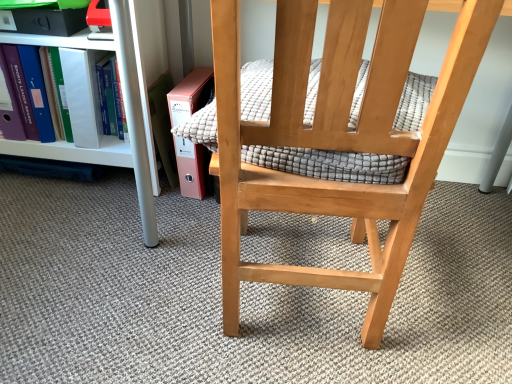
Question: Is natural wood chair at center in front of or behind white plastic shelf at left in the image?

Choices:
 (A) behind
 (B) front

Answer: (B)

Question: From the image's perspective, is natural wood chair at center above or below white plastic shelf at left?

Choices:
 (A) below
 (B) above

Answer: (A)

Question: Considering the real-world distances, which object is farthest from the natural wood chair at center?

Choices:
 (A) matte white folder at left
 (B) pink cardboard book at lower left
 (C) white plastic shelf at left
 (D) textured gray quilt at center

Answer: (A)

Question: Which object is positioned closest to the pink cardboard book at lower left?

Choices:
 (A) white plastic shelf at left
 (B) matte white folder at left
 (C) natural wood chair at center
 (D) textured gray quilt at center

Answer: (A)